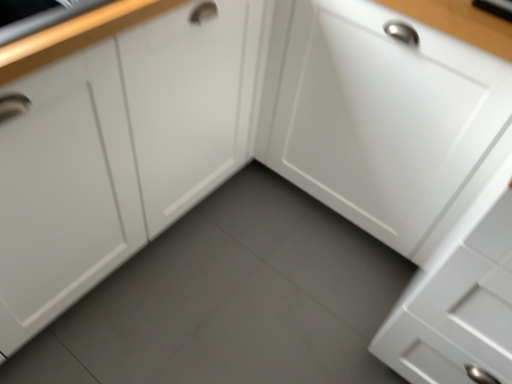
Question: Is white matte cabinet door at center, positioned as the first cabinetry in right-to-left order, inside the boundaries of white matte cabinet at center, acting as the first cabinetry starting from the left, or outside?

Choices:
 (A) inside
 (B) outside

Answer: (B)

Question: From the image's perspective, is white matte cabinet door at center, the 2th cabinetry from the left, above or below white matte cabinet at center, the second cabinetry in the right-to-left sequence?

Choices:
 (A) below
 (B) above

Answer: (A)

Question: Is point (312, 134) closer or farther from the camera than point (15, 115)?

Choices:
 (A) closer
 (B) farther

Answer: (B)

Question: Is white matte cabinet at center, the second cabinetry in the right-to-left sequence, inside the boundaries of white matte cabinet door at center, the 2th cabinetry from the left, or outside?

Choices:
 (A) inside
 (B) outside

Answer: (B)

Question: Considering their positions, is white matte cabinet at center, acting as the first cabinetry starting from the left, located in front of or behind white matte cabinet door at center, the 2th cabinetry from the left?

Choices:
 (A) behind
 (B) front

Answer: (B)

Question: Does point (113, 158) appear closer or farther from the camera than point (339, 112)?

Choices:
 (A) farther
 (B) closer

Answer: (B)

Question: From the image's perspective, is white matte cabinet at center, the second cabinetry in the right-to-left sequence, above or below white matte cabinet door at center, the 2th cabinetry from the left?

Choices:
 (A) above
 (B) below

Answer: (A)